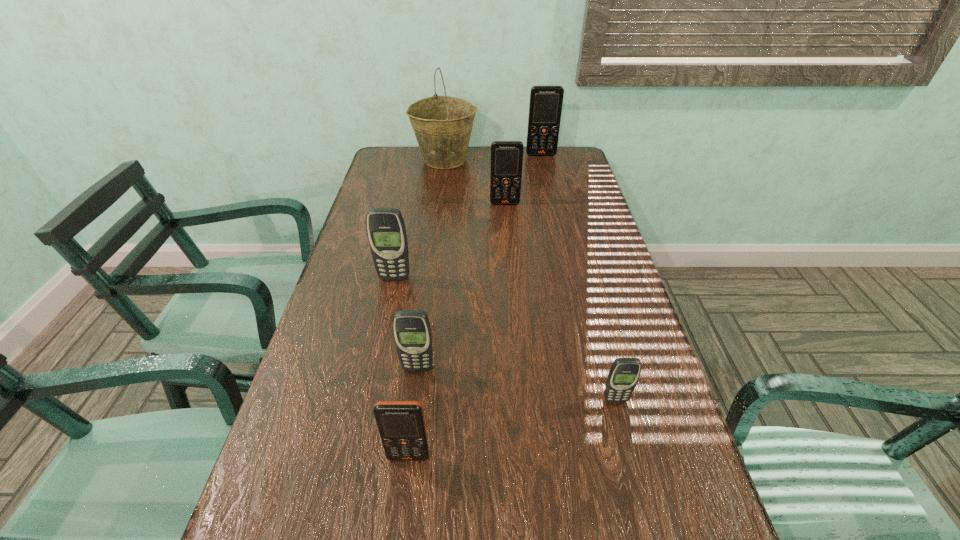
Find the location of `wine bucket present at the far edge`. wine bucket present at the far edge is located at coordinates (442, 125).

Image resolution: width=960 pixels, height=540 pixels. I want to click on cellular telephone that is at the far edge, so click(x=545, y=107).

The image size is (960, 540). I want to click on wine bucket that is at the left edge, so click(442, 125).

You are a GUI agent. You are given a task and a screenshot of the screen. Output one action in this format:
    pyautogui.click(x=<x>, y=<y>)
    Task: Click on the cellular telephone that is at the left edge
    This screenshot has height=540, width=960.
    Given the screenshot: What is the action you would take?
    pyautogui.click(x=386, y=232)

Find the location of a particular element. object that is at the far left corner is located at coordinates (442, 125).

This screenshot has width=960, height=540. In order to click on object that is at the far right corner in this screenshot , I will do `click(545, 107)`.

The height and width of the screenshot is (540, 960). I want to click on free space at the far edge of the desktop, so click(x=472, y=152).

Image resolution: width=960 pixels, height=540 pixels. I want to click on vacant space at the left edge of the desktop, so click(357, 281).

Image resolution: width=960 pixels, height=540 pixels. Identify the location of vacant space at the right edge of the desktop. tap(568, 200).

Find the location of a particular element. Image resolution: width=960 pixels, height=540 pixels. vacant space at the far left corner of the desktop is located at coordinates (413, 172).